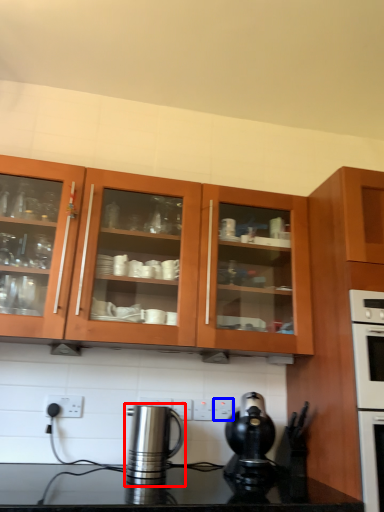
Question: Which point is closer to the camera, kitchen appliance (highlighted by a red box) or electric outlet (highlighted by a blue box)?

Choices:
 (A) kitchen appliance
 (B) electric outlet

Answer: (A)